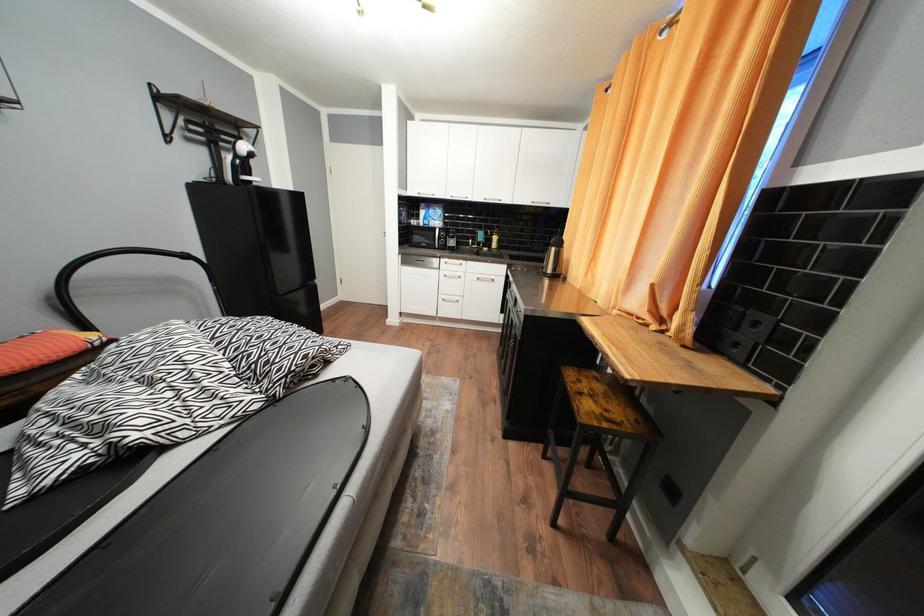
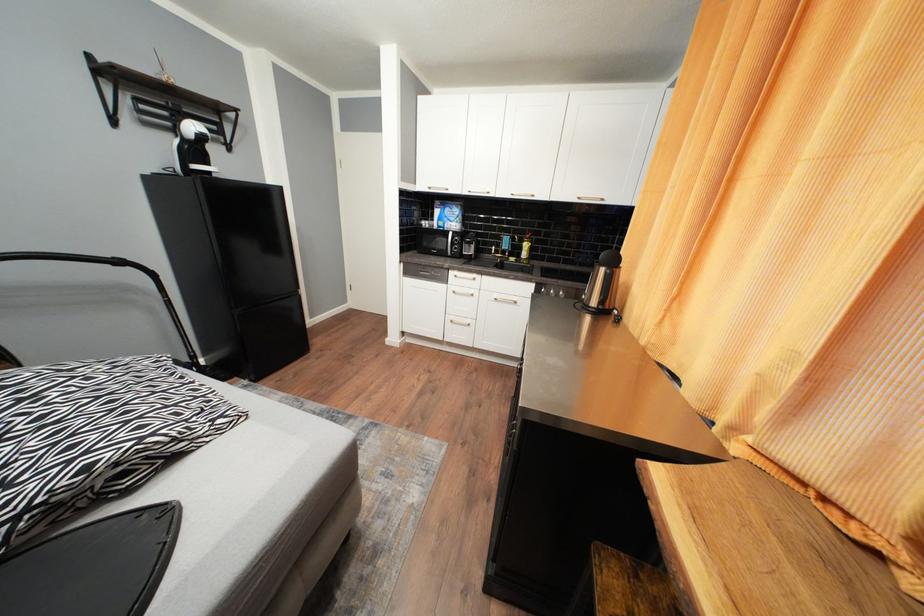
Which direction would the cameraman need to move to produce the second image?

The cameraman moved toward right, forward.